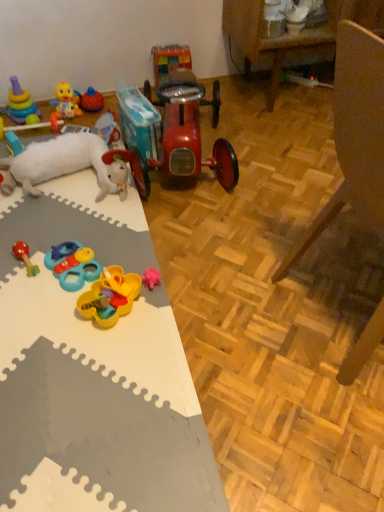
The width and height of the screenshot is (384, 512). Identify the location of free space that is to the left of yellow plastic toy at center, positioned as the 9th toy in left-to-right order. (49, 315).